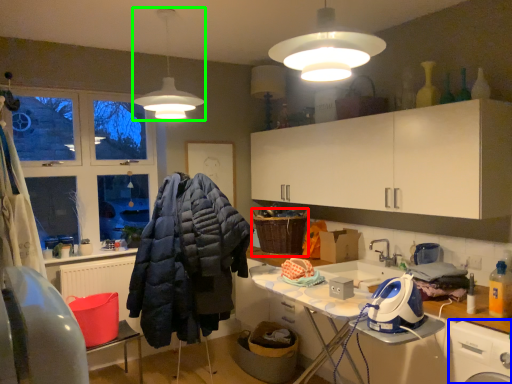
Question: Estimate the real-world distances between objects in this image. Which object is farther from basket (highlighted by a red box), washing machine (highlighted by a blue box) or lamp (highlighted by a green box)?

Choices:
 (A) washing machine
 (B) lamp

Answer: (A)